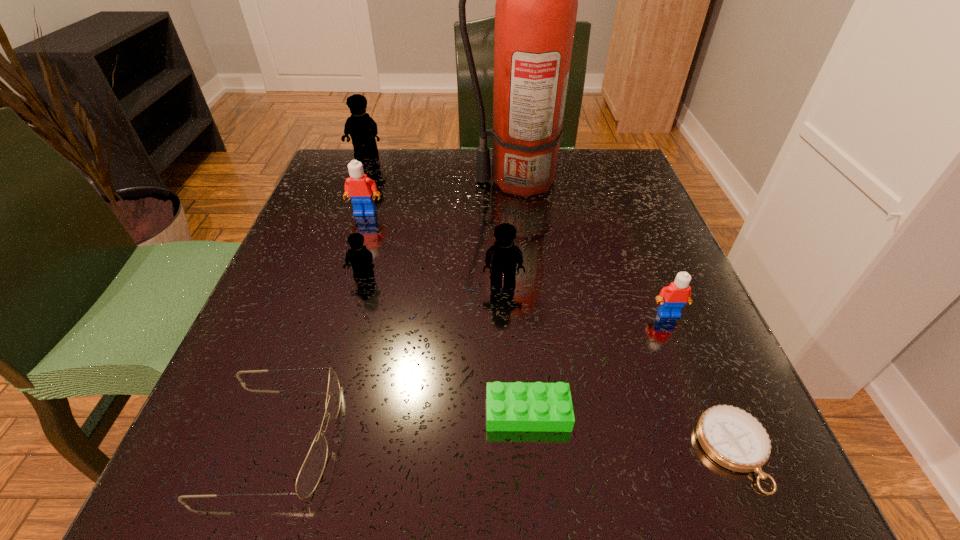
Locate an element on the screen. spectacles is located at coordinates (312, 469).

The height and width of the screenshot is (540, 960). I want to click on the third shortest object, so click(x=312, y=469).

Find the location of a particular element. The height and width of the screenshot is (540, 960). the shortest Lego is located at coordinates (526, 407).

The width and height of the screenshot is (960, 540). I want to click on the second shortest object, so click(x=526, y=407).

This screenshot has height=540, width=960. Identify the location of compass. (733, 438).

Locate an element on the screen. This screenshot has width=960, height=540. free region located 0.220m on the nozzle of the tallest object is located at coordinates (368, 181).

Identify the location of vacant area situated on the nozzle of the tallest object. (390, 181).

Identify the location of vacant space located 0.170m on the nozzle of the tallest object. (390, 181).

Locate an element on the screen. The height and width of the screenshot is (540, 960). vacant space situated 0.060m on the front-facing side of the farthest Lego is located at coordinates (359, 175).

The height and width of the screenshot is (540, 960). I want to click on free location located on the face of the bigger white Lego, so click(x=341, y=288).